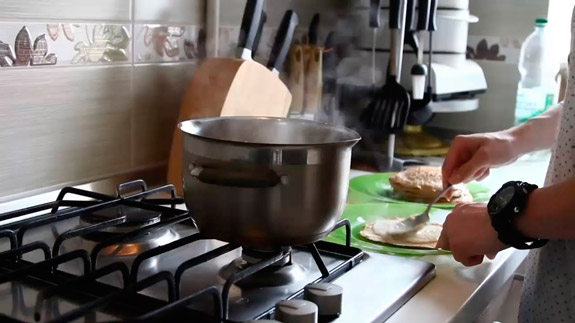
Identify the location of knife block. (233, 82).